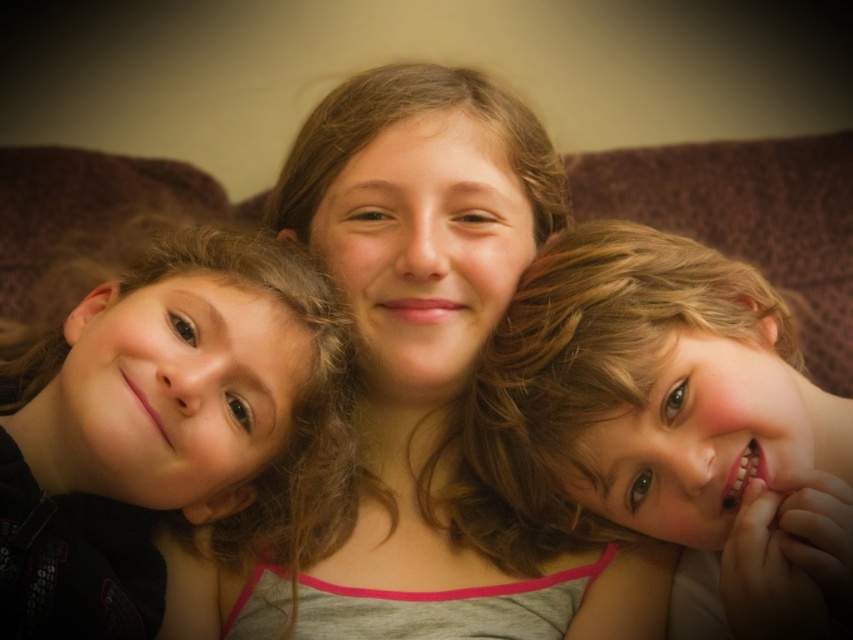
Based on the photo, you are a photographer adjusting your camera settings to focus on two specific points in the image. The first point is labeled as point (341, 134) and the second is point (686, 620). Since you can only focus on one point at a time, which point should you choose to ensure the closest subject remains sharp?

Point (341, 134) is closer to the viewer than point (686, 620), so you should focus on point (341, 134) to keep the closest subject sharp.

You are a photographer who wants to ensure all three children are visible in the photo. Given that the smooth skin child at center is taller than the dark brown hair at left, which child should you ask to sit slightly lower to avoid blocking the other?

The smooth skin child at center is taller than the dark brown hair at left, so you should ask the smooth skin child at center to sit slightly lower to avoid blocking the shorter child.

You are a photographer trying to capture a closeup of the smooth skin face at center and the smooth skin child at center. Based on their sizes in the image, which one would you need to move closer to the camera to get a similar sized closeup?

The smooth skin face at center is much taller than the smooth skin child at center, so to get a similar sized closeup, you would need to move the smooth skin child at center closer to the camera.